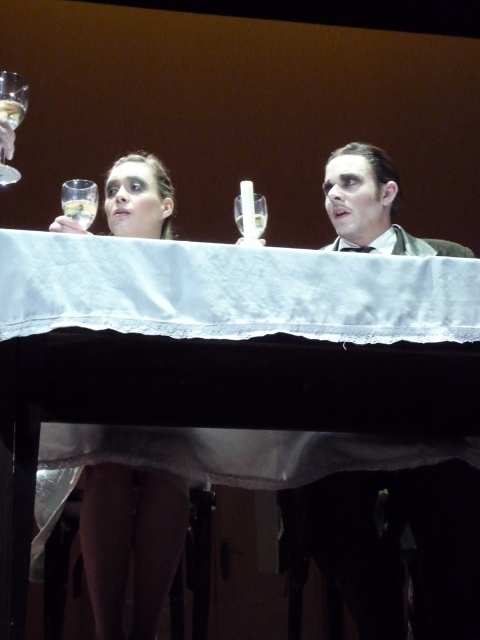
You are a stagehand who needs to place a small prop on the white cloth covered table at center. The coordinates given are point (230, 291). Is this point on the table?

Yes, the point (230, 291) is on the white cloth covered table at center according to the description.

You are standing in front of the table with two people holding glasses. There is a point marked at coordinates point (x=217, y=438). Can you reach this point without moving your position?

The point (x=217, y=438) is 17.88 feet away from the camera, so you cannot reach it without moving your position since it is too far away.